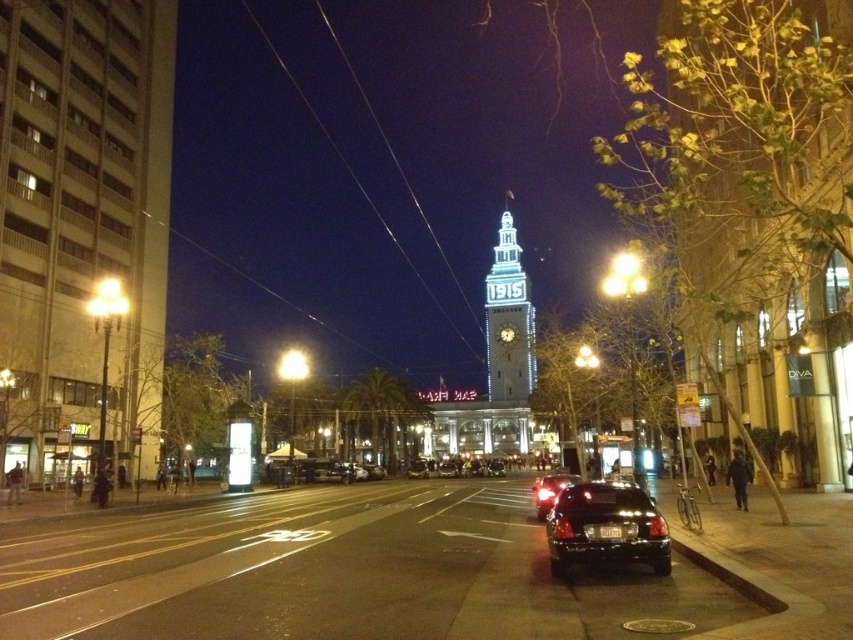
You are a pedestrian standing on the sidewalk looking at the clock tower. You see a black glossy car at center and a shiny black sedan at center. Which one is closer to the base of the clock tower?

The black glossy car at center is closer to the base of the clock tower because it is located below the shiny black sedan at center.

You are a photographer planning to capture the illuminated glass clock tower at center and the shiny black sedan at center in a single frame. Given that the camera can only focus on objects within a 10m width, will both objects fit in the frame if they are aligned horizontally?

The illuminated glass clock tower at center is bigger than the shiny black sedan at center. Since both are aligned horizontally, their combined width may exceed the camera frame limit of 10m. However, without specific distance or exact size measurements, it is impossible to confirm if they will fit.

You are standing on the sidewalk in front of the clock tower and want to take a photo of the illuminated glass clock tower at center and the shiny black sedan at center. Which object should you focus on first to ensure both are in sharp focus?

Since the illuminated glass clock tower at center is closer to the viewer than the shiny black sedan at center, you should focus on the clock tower first. This ensures that both objects will be in focus due to the depth of field extending from the closer object to the farther one.